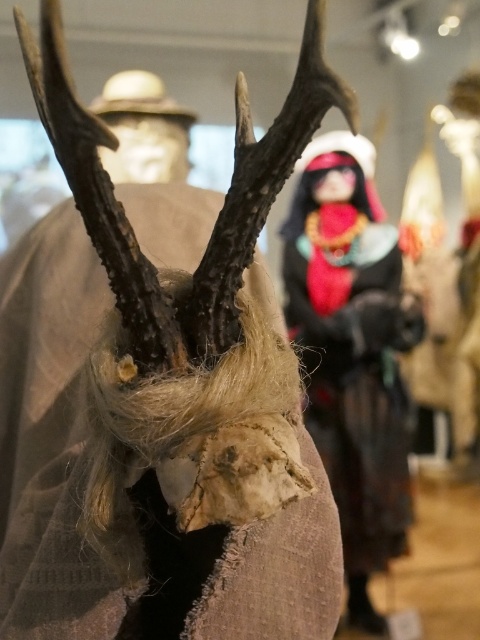
Question: Which object appears closest to the camera in this image?

Choices:
 (A) matte beige hat at upper center
 (B) velvet-like doll at center
 (C) brown textured antlers at center

Answer: (C)

Question: Can you confirm if brown textured antlers at center is positioned to the right of matte beige hat at upper center?

Choices:
 (A) yes
 (B) no

Answer: (A)

Question: In this image, where is velvet-like doll at center located relative to matte beige hat at upper center?

Choices:
 (A) right
 (B) left

Answer: (A)

Question: Which object is the farthest from the velvet-like doll at center?

Choices:
 (A) brown textured antlers at center
 (B) matte beige hat at upper center

Answer: (A)

Question: Which of the following is the closest to the observer?

Choices:
 (A) (73, 301)
 (B) (159, 90)

Answer: (A)

Question: Does brown textured antlers at center have a smaller size compared to matte beige hat at upper center?

Choices:
 (A) no
 (B) yes

Answer: (A)